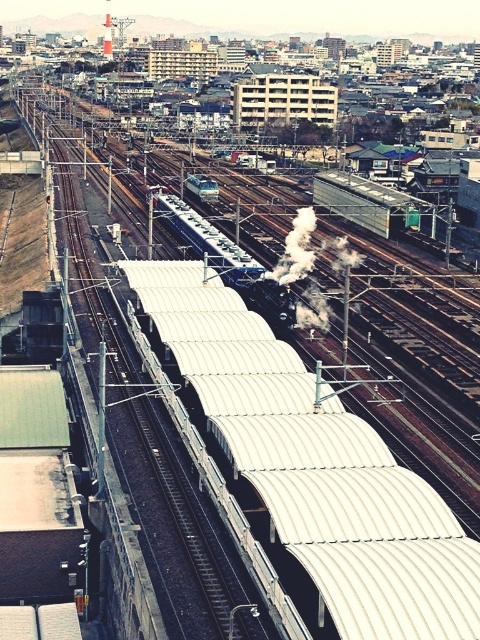
Question: Is white corrugated roof at center bigger than white smoke at center?

Choices:
 (A) no
 (B) yes

Answer: (B)

Question: In this image, where is white corrugated roof at center located relative to white smoke at center?

Choices:
 (A) right
 (B) left

Answer: (B)

Question: Which point appears farthest from the camera in this image?

Choices:
 (A) (300, 220)
 (B) (220, 451)

Answer: (A)

Question: Which point is farther from the camera taking this photo?

Choices:
 (A) (427, 534)
 (B) (300, 252)

Answer: (B)

Question: Is white corrugated roof at center further to camera compared to white smoke at center?

Choices:
 (A) no
 (B) yes

Answer: (A)